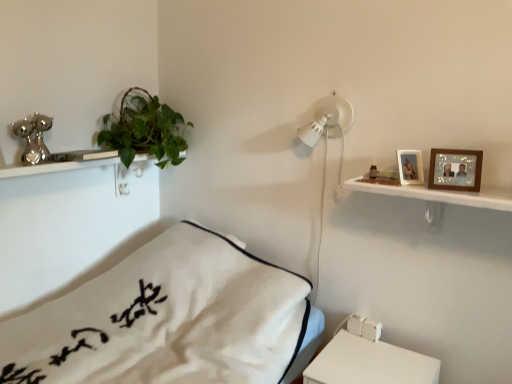
This screenshot has width=512, height=384. What do you see at coordinates (144, 129) in the screenshot?
I see `green leafy plant at upper left` at bounding box center [144, 129].

Identify the location of white matte table at lower right. The width and height of the screenshot is (512, 384). [369, 363].

This screenshot has width=512, height=384. What do you see at coordinates (410, 167) in the screenshot?
I see `wooden photo frame at upper right, which is the first picture frame from left to right` at bounding box center [410, 167].

What is the approximate width of wooden photo frame at upper right, the first picture frame in the back-to-front sequence?

The width of wooden photo frame at upper right, the first picture frame in the back-to-front sequence, is 9.31 centimeters.

Identify the location of green leafy plant at upper left. (144, 129).

Is wooden photo frame at upper right, which is the first picture frame from left to right, in front of green leafy plant at upper left?

Answer: Yes, the depth of wooden photo frame at upper right, which is the first picture frame from left to right, is less than that of green leafy plant at upper left.

Find the location of `the 1st picture frame below the green leafy plant at upper left (from the image's perspective)`. the 1st picture frame below the green leafy plant at upper left (from the image's perspective) is located at coordinates (410, 167).

In terms of width, does wooden photo frame at upper right, which is the first picture frame from left to right, look wider or thinner when compared to green leafy plant at upper left?

wooden photo frame at upper right, which is the first picture frame from left to right, is thinner than green leafy plant at upper left.

How much distance is there between wooden picture frame at upper right, acting as the 2th picture frame starting from the left, and white matte table at lower right?

wooden picture frame at upper right, acting as the 2th picture frame starting from the left, is 27.83 inches away from white matte table at lower right.

Find the location of a particular element. This screenshot has width=512, height=384. table on the left of wooden picture frame at upper right, placed as the 1th picture frame when sorted from right to left is located at coordinates (369, 363).

Is wooden picture frame at upper right, arranged as the second picture frame when viewed from the back, further to camera compared to white matte table at lower right?

Yes.

How many degrees apart are the facing directions of wooden picture frame at upper right, placed as the 1th picture frame when sorted from right to left, and white matte table at lower right?

wooden picture frame at upper right, placed as the 1th picture frame when sorted from right to left, and white matte table at lower right are facing 19.6 degrees away from each other.

Is wooden picture frame at upper right, acting as the 2th picture frame starting from the left, inside wooden photo frame at upper right, which is the first picture frame from left to right?

No, wooden picture frame at upper right, acting as the 2th picture frame starting from the left, is not a part of wooden photo frame at upper right, which is the first picture frame from left to right.

From a real-world perspective, is wooden photo frame at upper right, the first picture frame in the back-to-front sequence, positioned over wooden picture frame at upper right, placed as the 1th picture frame when sorted from right to left, based on gravity?

No, from a real-world perspective, wooden photo frame at upper right, the first picture frame in the back-to-front sequence, is not on top of wooden picture frame at upper right, placed as the 1th picture frame when sorted from right to left.

Consider the image. Are wooden photo frame at upper right, which is the first picture frame from left to right, and wooden picture frame at upper right, placed as the 1th picture frame when sorted from right to left, far apart?

No, wooden photo frame at upper right, which is the first picture frame from left to right, is in close proximity to wooden picture frame at upper right, placed as the 1th picture frame when sorted from right to left.

Does point (416, 176) lie behind point (472, 151)?

Yes, it is.

Can you confirm if wooden photo frame at upper right, which is the first picture frame from left to right, is positioned to the right of white matte table at lower right?

Indeed, wooden photo frame at upper right, which is the first picture frame from left to right, is positioned on the right side of white matte table at lower right.

From the image's perspective, would you say wooden photo frame at upper right, which is the first picture frame from left to right, is shown under white matte table at lower right?

No.

Looking at this image, is wooden photo frame at upper right, the first picture frame in the back-to-front sequence, next to white matte table at lower right and touching it?

No, wooden photo frame at upper right, the first picture frame in the back-to-front sequence, is not with white matte table at lower right.

From the image's perspective, is green leafy plant at upper left over wooden picture frame at upper right, acting as the 2th picture frame starting from the left?

Correct, green leafy plant at upper left appears higher than wooden picture frame at upper right, acting as the 2th picture frame starting from the left, in the image.

What's the angular difference between green leafy plant at upper left and wooden picture frame at upper right, placed as the 1th picture frame when sorted from right to left,'s facing directions?

The facing directions of green leafy plant at upper left and wooden picture frame at upper right, placed as the 1th picture frame when sorted from right to left, are 70 degrees apart.

Considering the sizes of objects green leafy plant at upper left and wooden picture frame at upper right, placed as the 1th picture frame when sorted from right to left, in the image provided, who is taller, green leafy plant at upper left or wooden picture frame at upper right, placed as the 1th picture frame when sorted from right to left,?

With more height is green leafy plant at upper left.

Identify the location of houseplant above the wooden picture frame at upper right, acting as the 2th picture frame starting from the left (from a real-world perspective). This screenshot has height=384, width=512. (144, 129).

Considering the sizes of objects white cotton bed at center and wooden photo frame at upper right, which is the first picture frame from left to right, in the image provided, who is smaller, white cotton bed at center or wooden photo frame at upper right, which is the first picture frame from left to right,?

wooden photo frame at upper right, which is the first picture frame from left to right.

Does point (77, 289) lie behind point (417, 180)?

Yes, point (77, 289) is behind point (417, 180).

From the picture: Does white cotton bed at center come in front of wooden photo frame at upper right, the first picture frame in the back-to-front sequence?

Yes, white cotton bed at center is closer to the viewer.

Which picture frame is the 1st one when counting from the right side of the white cotton bed at center? Please provide its 2D coordinates.

[(410, 167)]

I want to click on bed below the wooden picture frame at upper right, placed as the 1th picture frame when sorted from right to left (from a real-world perspective), so click(x=166, y=319).

Is wooden picture frame at upper right, placed as the 1th picture frame when sorted from right to left, with white cotton bed at center?

No, wooden picture frame at upper right, placed as the 1th picture frame when sorted from right to left, is not in contact with white cotton bed at center.

Which is more to the left, wooden picture frame at upper right, arranged as the second picture frame when viewed from the back, or white cotton bed at center?

From the viewer's perspective, white cotton bed at center appears more on the left side.

Locate an element on the screen. houseplant positioned vertically above the wooden photo frame at upper right, which is the first picture frame from left to right (from a real-world perspective) is located at coordinates (144, 129).

Image resolution: width=512 pixels, height=384 pixels. What are the coordinates of `picture frame that is the 1st one when counting upward from the white matte table at lower right (from the image's perspective)` in the screenshot? It's located at (455, 169).

When comparing their distances from wooden picture frame at upper right, arranged as the second picture frame when viewed from the back, does wooden photo frame at upper right, positioned as the second picture frame in front-to-back order, or green leafy plant at upper left seem closer?

wooden photo frame at upper right, positioned as the second picture frame in front-to-back order.

Consider the image. From the image, which object appears to be farther from wooden photo frame at upper right, positioned as the second picture frame in front-to-back order, wooden picture frame at upper right, placed as the 1th picture frame when sorted from right to left, or white matte table at lower right?

Among the two, white matte table at lower right is located further to wooden photo frame at upper right, positioned as the second picture frame in front-to-back order.

Estimate the real-world distances between objects in this image. Which object is further from green leafy plant at upper left, wooden photo frame at upper right, the first picture frame in the back-to-front sequence, or wooden picture frame at upper right, acting as the 2th picture frame starting from the left?

Among the two, wooden picture frame at upper right, acting as the 2th picture frame starting from the left, is located further to green leafy plant at upper left.

In the scene shown: Estimate the real-world distances between objects in this image. Which object is closer to wooden picture frame at upper right, the 1th picture frame viewed from the front, green leafy plant at upper left or white matte table at lower right?

white matte table at lower right lies closer to wooden picture frame at upper right, the 1th picture frame viewed from the front, than the other object.

When comparing their distances from white cotton bed at center, does white matte table at lower right or wooden photo frame at upper right, which is the first picture frame from left to right, seem further?

Based on the image, wooden photo frame at upper right, which is the first picture frame from left to right, appears to be further to white cotton bed at center.

From the picture: Based on their spatial positions, is green leafy plant at upper left or wooden picture frame at upper right, acting as the 2th picture frame starting from the left, closer to white cotton bed at center?

green leafy plant at upper left is closer to white cotton bed at center.

Based on their spatial positions, is wooden photo frame at upper right, positioned as the second picture frame in front-to-back order, or wooden picture frame at upper right, arranged as the second picture frame when viewed from the back, closer to white matte table at lower right?

Based on the image, wooden photo frame at upper right, positioned as the second picture frame in front-to-back order, appears to be nearer to white matte table at lower right.

From the image, which object appears to be nearer to white cotton bed at center, white matte table at lower right or green leafy plant at upper left?

Among the two, white matte table at lower right is located nearer to white cotton bed at center.

The height and width of the screenshot is (384, 512). In order to click on picture frame located between green leafy plant at upper left and wooden picture frame at upper right, arranged as the second picture frame when viewed from the back, in the left-right direction in this screenshot , I will do `click(410, 167)`.

Locate an element on the screen. picture frame that lies between wooden photo frame at upper right, the first picture frame in the back-to-front sequence, and white matte table at lower right from top to bottom is located at coordinates (455, 169).

Find the location of a particular element. This screenshot has height=384, width=512. picture frame between white cotton bed at center and wooden picture frame at upper right, acting as the 2th picture frame starting from the left, in the horizontal direction is located at coordinates (410, 167).

I want to click on bed located between green leafy plant at upper left and wooden picture frame at upper right, the 1th picture frame viewed from the front, in the left-right direction, so click(x=166, y=319).